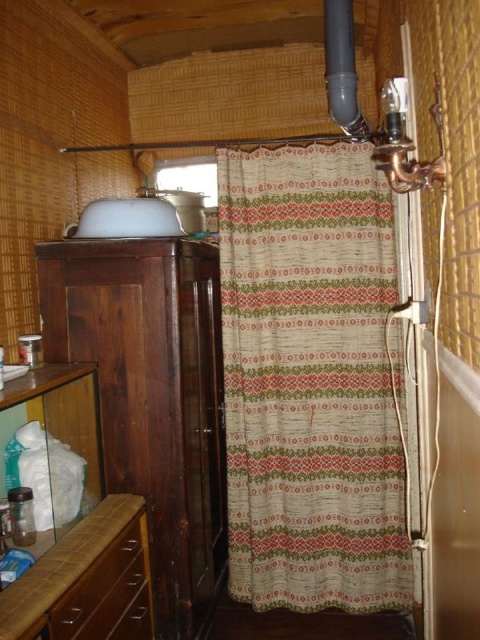
Question: Is patterned fabric shower curtain at center positioned in front of brown wood drawer at lower left?

Choices:
 (A) no
 (B) yes

Answer: (A)

Question: Is patterned fabric shower curtain at center above brown wood drawer at lower left?

Choices:
 (A) yes
 (B) no

Answer: (A)

Question: Does patterned fabric shower curtain at center appear under brown wood drawer at lower left?

Choices:
 (A) yes
 (B) no

Answer: (B)

Question: Which object is farther from the camera taking this photo?

Choices:
 (A) patterned fabric shower curtain at center
 (B) brown wood drawer at lower left

Answer: (A)

Question: Among these objects, which one is nearest to the camera?

Choices:
 (A) patterned fabric shower curtain at center
 (B) brown wood drawer at lower left

Answer: (B)